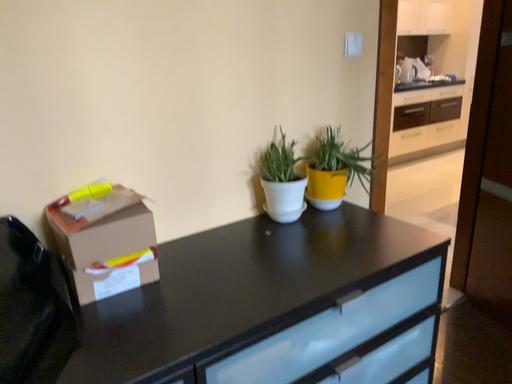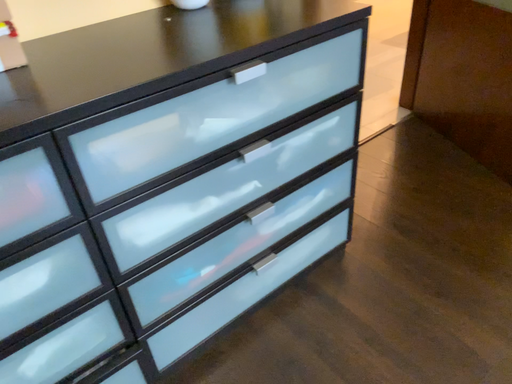
Question: Which way did the camera rotate in the video?

Choices:
 (A) rotated downward
 (B) rotated upward

Answer: (A)